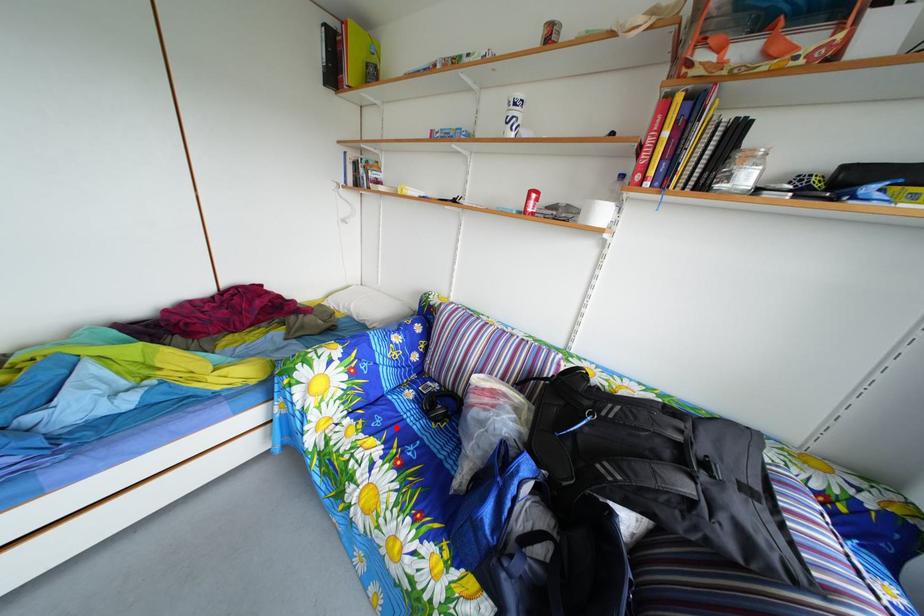
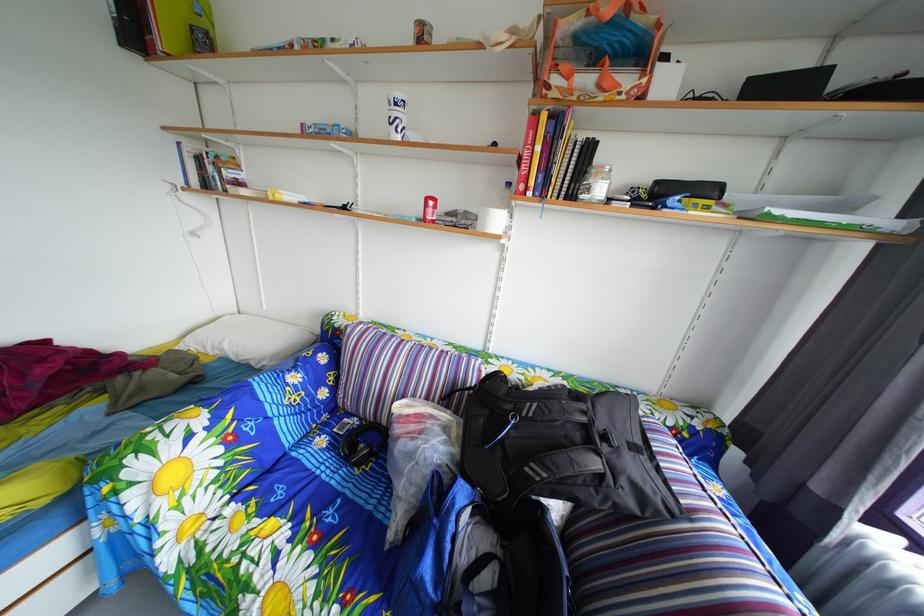
Locate, in the second image, the point that corresponds to the highlighted location in the first image.

(301, 493)